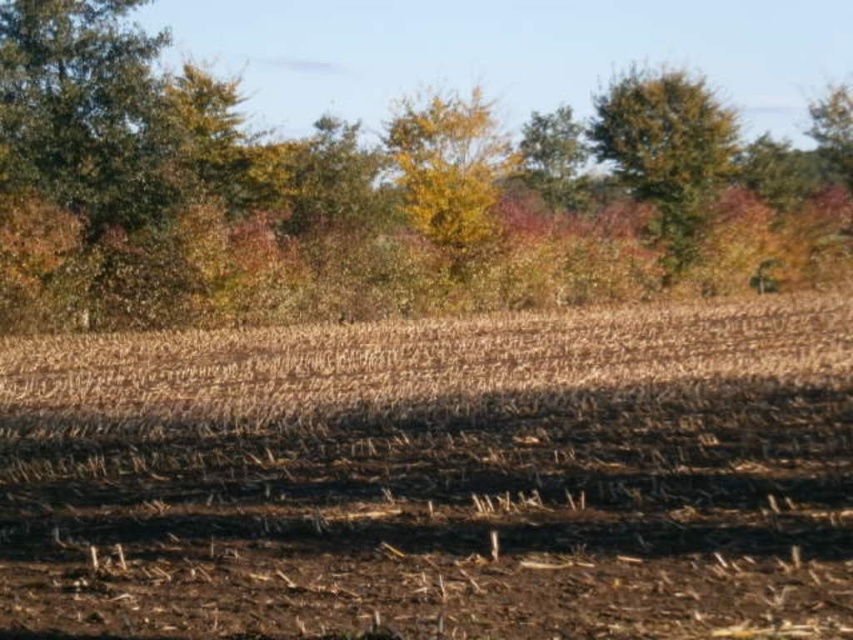
Question: Is brown soil at center wider than green leafy tree at upper right?

Choices:
 (A) yes
 (B) no

Answer: (A)

Question: Where is yellow leafy tree at center located in relation to green leafy tree at upper center in the image?

Choices:
 (A) left
 (B) right

Answer: (A)

Question: Does yellow-green foliage at upper center have a lesser width compared to green leafy tree at upper center?

Choices:
 (A) no
 (B) yes

Answer: (A)

Question: Which of the following is the farthest from the observer?

Choices:
 (A) (543, 116)
 (B) (390, 157)
 (C) (662, 166)

Answer: (A)

Question: Which of the following is the closest to the observer?

Choices:
 (A) (247, 253)
 (B) (570, 157)
 (C) (669, 132)

Answer: (A)

Question: Which object appears farthest from the camera in this image?

Choices:
 (A) yellow leafy tree at center
 (B) green leafy tree at upper center
 (C) yellow-green foliage at upper center
 (D) green leafy tree at upper right

Answer: (B)